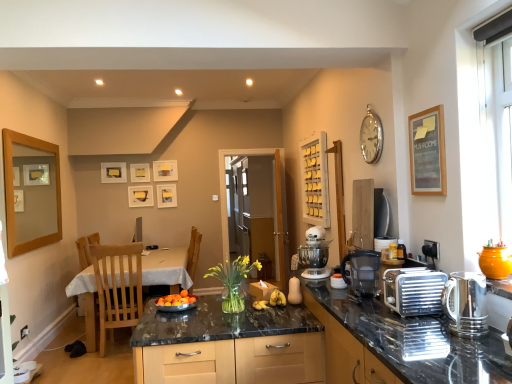
Identify the location of empty space that is ontop of silver metallic toaster at right, the first appliance in the back-to-front sequence. (406, 265).